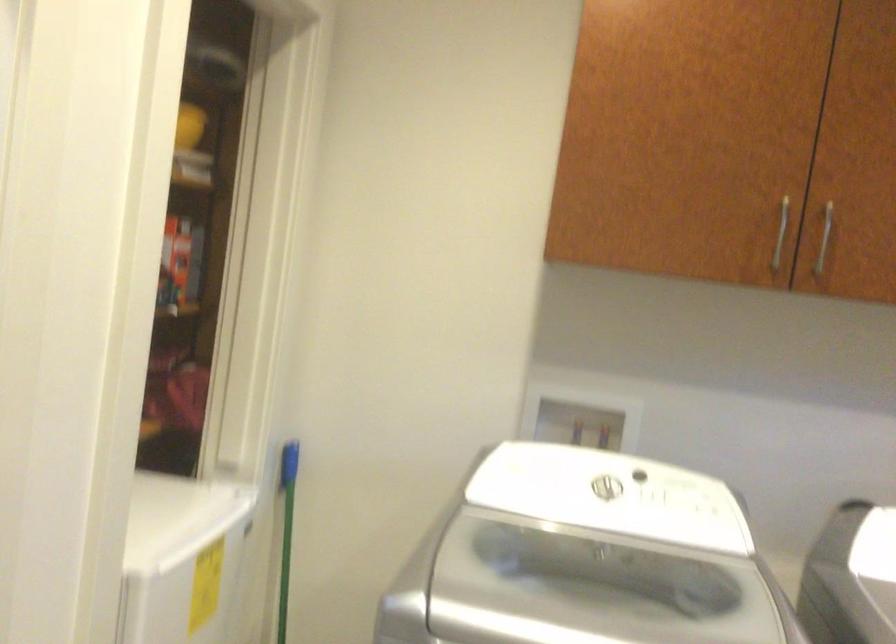
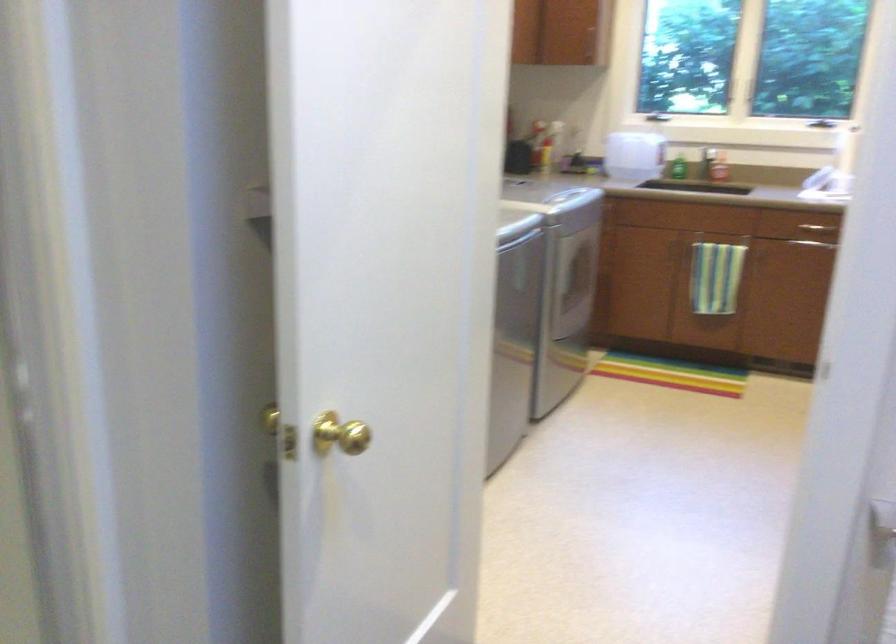
Question: I am providing you with two images of the same scene from different viewpoints. Please identify which objects are invisible in image2.

Choices:
 (A) long silver handle
 (B) green soap bottle
 (C) towel rack handle
 (D) green broom handle

Answer: (D)